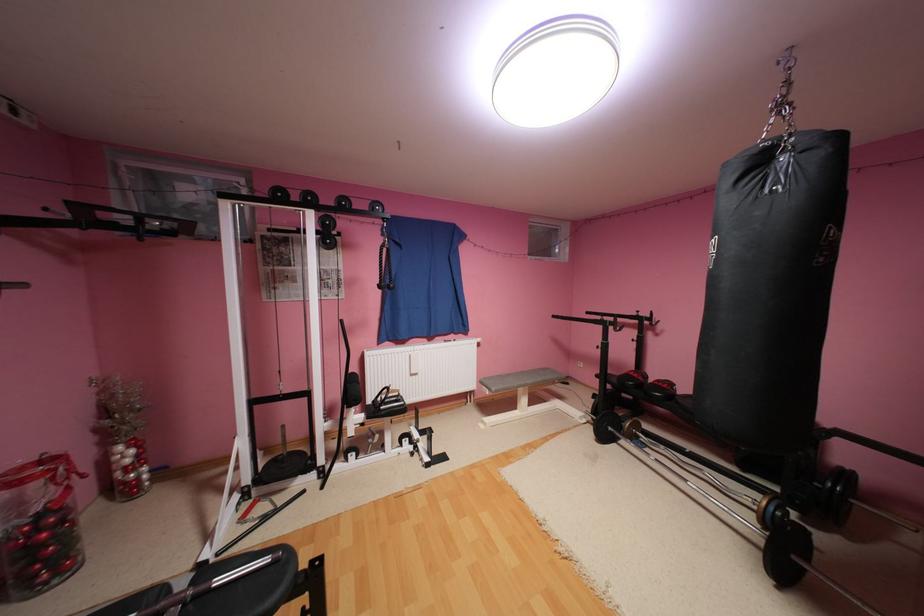
The image size is (924, 616). What do you see at coordinates (91, 217) in the screenshot? I see `a black pull-up handle` at bounding box center [91, 217].